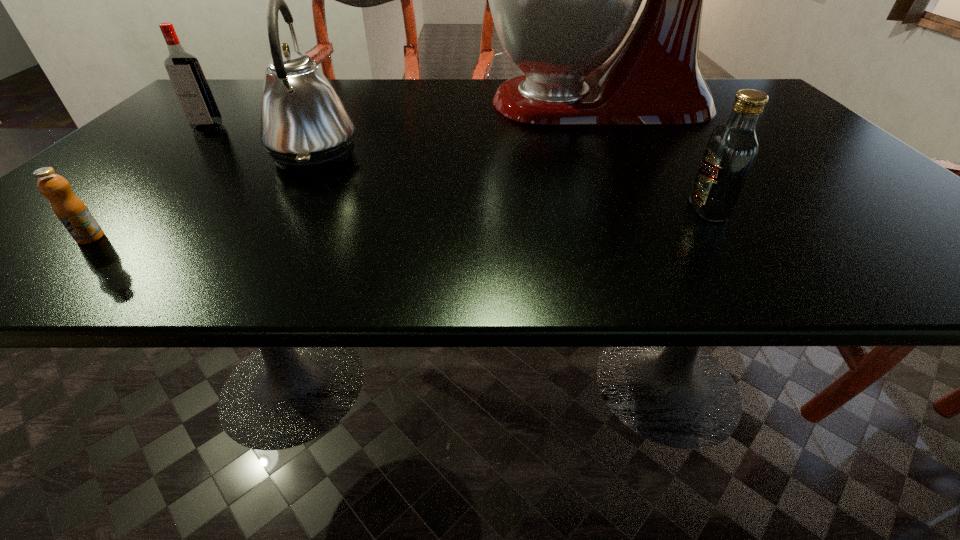
The height and width of the screenshot is (540, 960). Find the location of `mixer`. mixer is located at coordinates (562, 0).

Where is `the third object from left to right`? The width and height of the screenshot is (960, 540). the third object from left to right is located at coordinates tap(304, 126).

Where is `kettle`? The width and height of the screenshot is (960, 540). kettle is located at coordinates (304, 126).

Find the location of a particular element. This screenshot has height=540, width=960. the farther vodka is located at coordinates (188, 80).

Where is `the second nearest object`? The width and height of the screenshot is (960, 540). the second nearest object is located at coordinates (732, 148).

Image resolution: width=960 pixels, height=540 pixels. I want to click on the nearer vodka, so click(732, 148).

At what (x,y) coordinates should I click in order to perform the action: click on the shortest object. Please return your answer as a coordinate pair (x, y). Looking at the image, I should click on (72, 212).

The height and width of the screenshot is (540, 960). What are the coordinates of `the nearest object` in the screenshot? It's located at (72, 212).

This screenshot has width=960, height=540. What are the coordinates of `free space located 0.160m at the attachment hub of the mixer` in the screenshot? It's located at (419, 103).

Locate an element on the screen. free space located 0.290m at the attachment hub of the mixer is located at coordinates (367, 103).